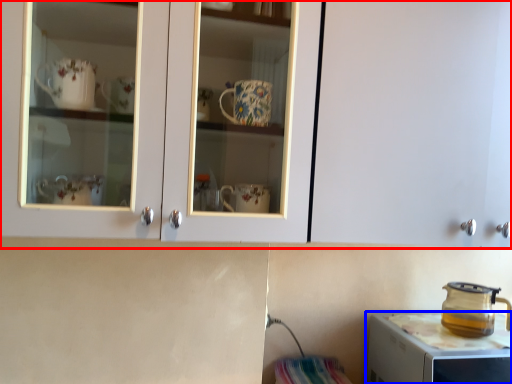
Question: Which of the following is the farthest to the observer, cabinetry (highlighted by a red box) or home appliance (highlighted by a blue box)?

Choices:
 (A) cabinetry
 (B) home appliance

Answer: (B)